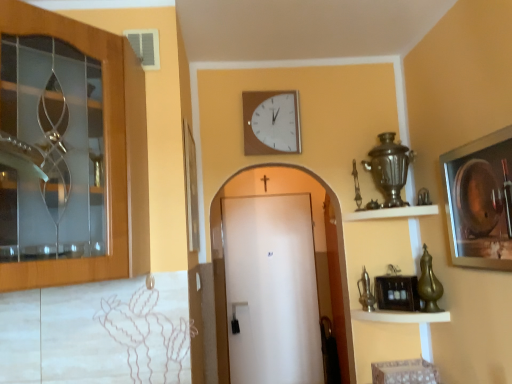
Question: From the image's perspective, is metallic brass shelf at lower right, which is the 2th shelf from top to bottom, below white matte door at center, which is counted as the 2th door, starting from the top?

Choices:
 (A) no
 (B) yes

Answer: (A)

Question: Is metallic brass shelf at lower right, arranged as the 1th shelf when ordered from the bottom, shorter than white matte door at center, the first door positioned from the right?

Choices:
 (A) yes
 (B) no

Answer: (A)

Question: Considering the relative sizes of metallic brass shelf at lower right, which is the 2th shelf from top to bottom, and white matte door at center, the first door positioned from the right, in the image provided, is metallic brass shelf at lower right, which is the 2th shelf from top to bottom, wider than white matte door at center, the first door positioned from the right,?

Choices:
 (A) yes
 (B) no

Answer: (A)

Question: Is the depth of metallic brass shelf at lower right, which is the 2th shelf from top to bottom, less than that of white matte door at center, which is counted as the 2th door, starting from the top?

Choices:
 (A) no
 (B) yes

Answer: (B)

Question: From a real-world perspective, is metallic brass shelf at lower right, arranged as the 1th shelf when ordered from the bottom, below white matte door at center, the 2th door from the front?

Choices:
 (A) yes
 (B) no

Answer: (B)

Question: In terms of width, does white matte door at center, which is counted as the 2th door, starting from the top, look wider or thinner when compared to metallic brass shelf at lower right, arranged as the 1th shelf when ordered from the bottom?

Choices:
 (A) wide
 (B) thin

Answer: (B)

Question: From a real-world perspective, is white matte door at center, which appears as the 2th door when viewed from the left, positioned above or below metallic brass shelf at lower right, which is the 2th shelf from top to bottom?

Choices:
 (A) above
 (B) below

Answer: (B)

Question: Based on their positions, is white matte door at center, the first door in the bottom-to-top sequence, located to the left or right of metallic brass shelf at lower right, which is the 2th shelf from top to bottom?

Choices:
 (A) right
 (B) left

Answer: (B)

Question: From the image's perspective, is white matte door at center, the first door in the bottom-to-top sequence, above or below metallic brass shelf at lower right, which is the 2th shelf from top to bottom?

Choices:
 (A) below
 (B) above

Answer: (A)

Question: Is point (302, 180) closer or farther from the camera than point (298, 122)?

Choices:
 (A) closer
 (B) farther

Answer: (B)

Question: Would you say white matte door at center, which appears as the 2th door when viewed from the left, is inside or outside white wooden clock at upper center?

Choices:
 (A) outside
 (B) inside

Answer: (A)

Question: Looking at their shapes, would you say white matte door at center, the 2th door from the front, is wider or thinner than white wooden clock at upper center?

Choices:
 (A) wide
 (B) thin

Answer: (A)

Question: Is white matte door at center, which is counted as the 2th door, starting from the top, taller or shorter than white wooden clock at upper center?

Choices:
 (A) short
 (B) tall

Answer: (B)

Question: In terms of height, does metallic silver picture frame at right look taller or shorter compared to white wooden clock at upper center?

Choices:
 (A) tall
 (B) short

Answer: (A)

Question: Considering their positions, is metallic silver picture frame at right located in front of or behind white wooden clock at upper center?

Choices:
 (A) front
 (B) behind

Answer: (A)